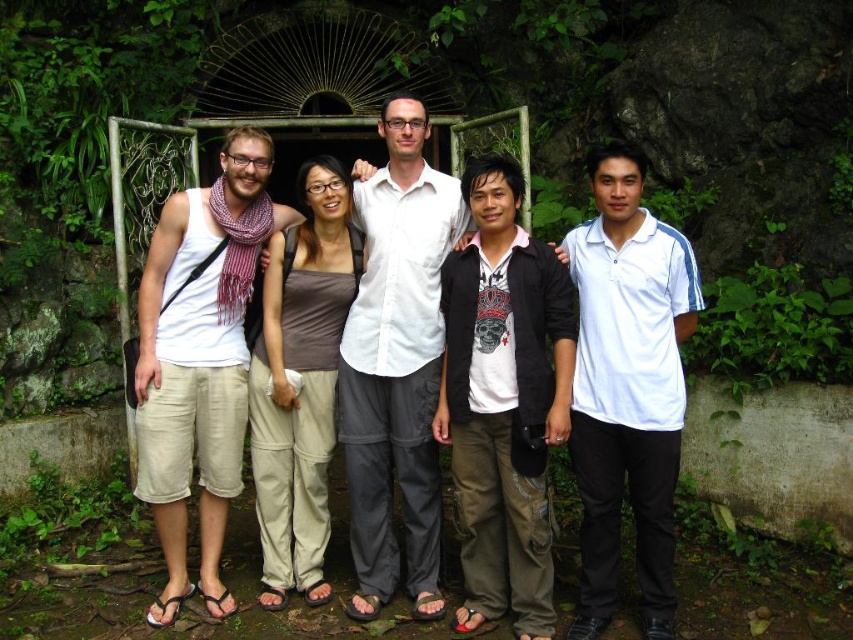
Question: Can you confirm if white smooth polo shirt at center is positioned below white matte shirt at center?

Choices:
 (A) no
 (B) yes

Answer: (B)

Question: Is white cotton tank top at left to the right of white cotton shirt at center from the viewer's perspective?

Choices:
 (A) yes
 (B) no

Answer: (B)

Question: Which of these objects is positioned closest to the dark gray cotton shirt at center?

Choices:
 (A) white cotton tank top at left
 (B) white smooth polo shirt at center
 (C) white matte shirt at center
 (D) white cotton shirt at center

Answer: (D)

Question: Which is nearer to the white cotton shirt at center?

Choices:
 (A) white matte shirt at center
 (B) dark gray cotton shirt at center
 (C) white smooth polo shirt at center
 (D) white cotton tank top at left

Answer: (C)

Question: Which point is farther from the camera taking this photo?

Choices:
 (A) (223, 502)
 (B) (438, 198)
 (C) (653, 392)
 (D) (495, 179)

Answer: (B)

Question: Can you confirm if dark gray cotton shirt at center is positioned above white cotton shirt at center?

Choices:
 (A) yes
 (B) no

Answer: (B)